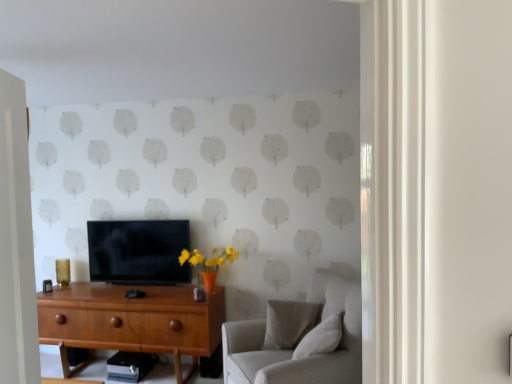
Question: In terms of width, does light gray fabric couch at right look wider or thinner when compared to wooden desk at center?

Choices:
 (A) thin
 (B) wide

Answer: (B)

Question: Would you say light gray fabric couch at right is to the left or to the right of wooden desk at center in the picture?

Choices:
 (A) left
 (B) right

Answer: (B)

Question: Based on their relative distances, which object is farther from the light gray fabric couch at right?

Choices:
 (A) wooden desk at center
 (B) light gray fabric pillow at center, arranged as the 2th pillow when viewed from the front
 (C) matte black tv at center
 (D) white textured pillow at lower right, which is the first pillow from front to back

Answer: (C)

Question: Estimate the real-world distances between objects in this image. Which object is closer to the light gray fabric pillow at center, arranged as the 2th pillow when viewed from the front?

Choices:
 (A) wooden desk at center
 (B) light gray fabric couch at right
 (C) white textured pillow at lower right, which is the first pillow from front to back
 (D) matte black tv at center

Answer: (B)